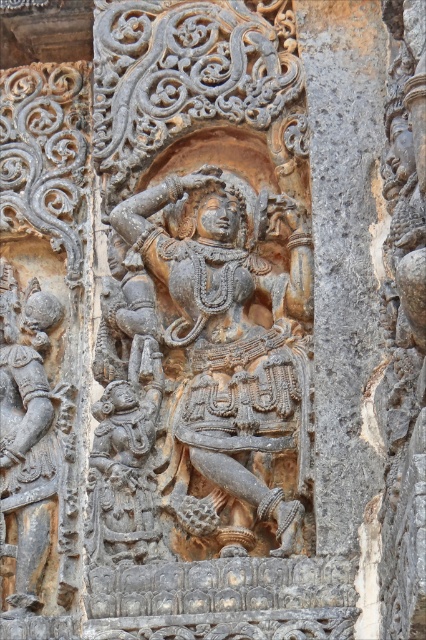
You are an art conservator examining the intricate stone relief. You notice the carved stone dancer at center and the gray stone pillar at center. Which object appears bigger in the carving?

The carved stone dancer at center is larger than the gray stone pillar at center in the carving.

In the scene shown: You are an archaeologist examining the stone relief. You notice the gray stone pillar at center and the gray stone warrior at left. Which object is located to the right of the other?

The gray stone pillar at center is positioned on the right side of the gray stone warrior at left, so the gray stone pillar at center is to the right of the gray stone warrior at left.

You are an archaeologist examining the intricate stone relief. You notice the gray stone pillar at center and the gray stone warrior at left. Which object occupies more space in the carving?

The gray stone pillar at center has a larger size compared to the gray stone warrior at left, so it occupies more space in the carving.